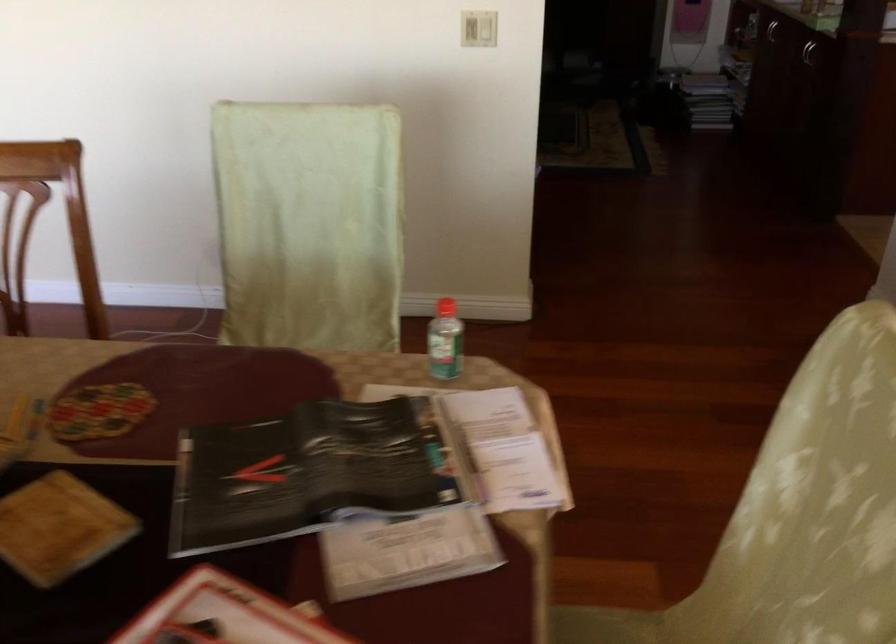
The height and width of the screenshot is (644, 896). What do you see at coordinates (478, 29) in the screenshot? I see `the white light switch` at bounding box center [478, 29].